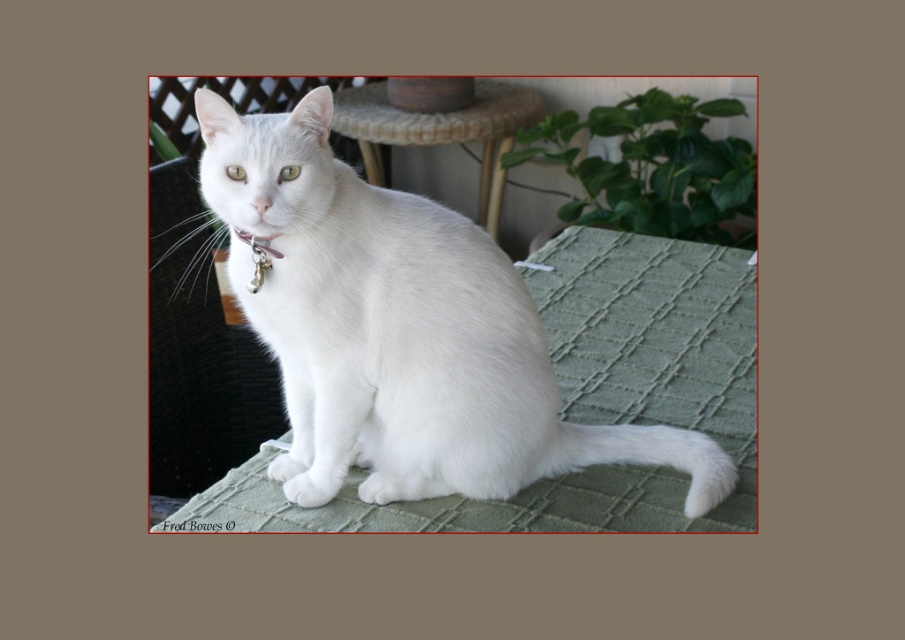
Is point (375, 192) farther from viewer compared to point (450, 113)?

No, (375, 192) is closer to viewer.

Consider the image. Does white fur cat at center have a lesser height compared to green woven table at center?

Indeed, white fur cat at center has a lesser height compared to green woven table at center.

Is point (386, 346) positioned before point (399, 109)?

Yes, it is.

In order to click on white fur cat at center in this screenshot , I will do `click(399, 330)`.